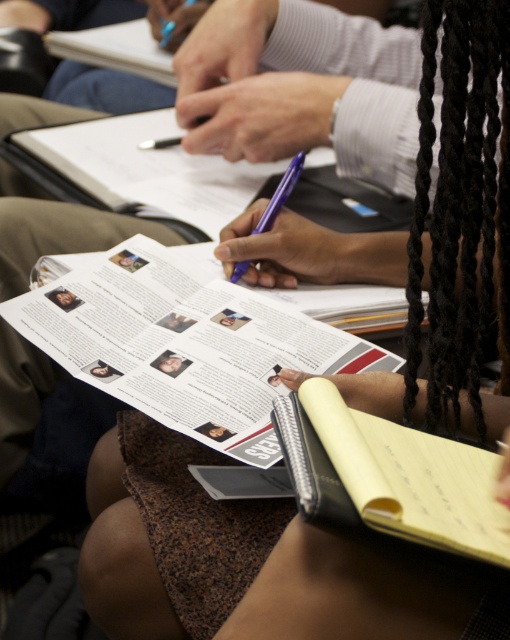
You are organizing a workshop and need to place two yellow items on a table. The yellow paper at center and the yellow paper notebook at lower right must be placed exactly 10 inches apart. Based on the current arrangement, will you need to move them closer or further apart to meet this requirement?

The yellow paper at center and yellow paper notebook at lower right are currently 9.50 inches apart. To reach the required 10 inches, you need to move them slightly further apart.

You are an observer looking at the scene. You see the yellow paper notebook at lower right and the purple plastic pen at center. Which object is positioned more to the right side of the scene?

The yellow paper notebook at lower right is positioned more to the right side of the scene than the purple plastic pen at center.